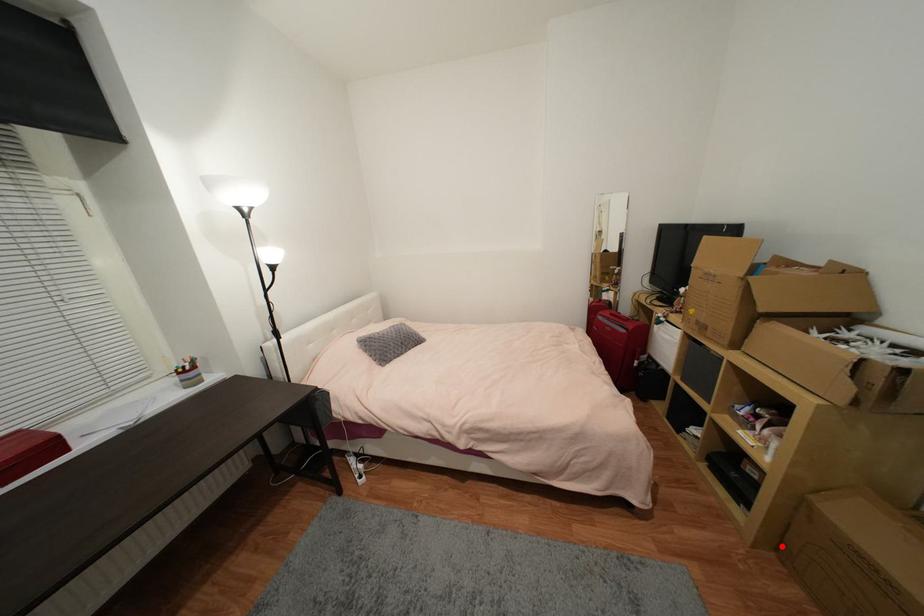
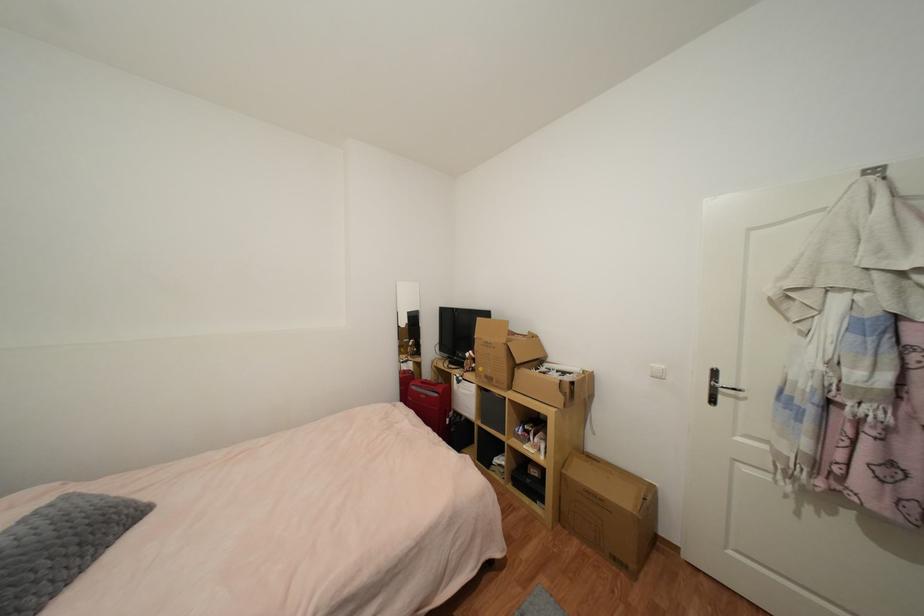
In the second image, find the point that corresponds to the highlighted location in the first image.

(564, 517)